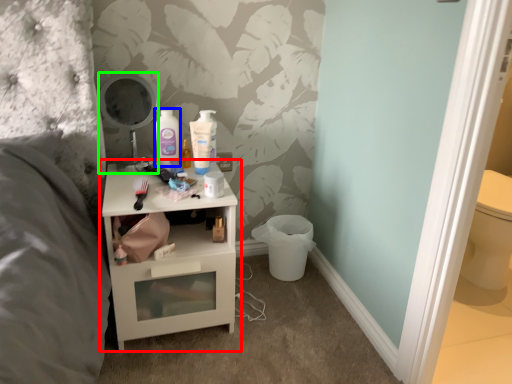
Question: Estimate the real-world distances between objects in this image. Which object is closer to nightstand (highlighted by a red box), mouthwash (highlighted by a blue box) or mirror (highlighted by a green box)?

Choices:
 (A) mouthwash
 (B) mirror

Answer: (B)